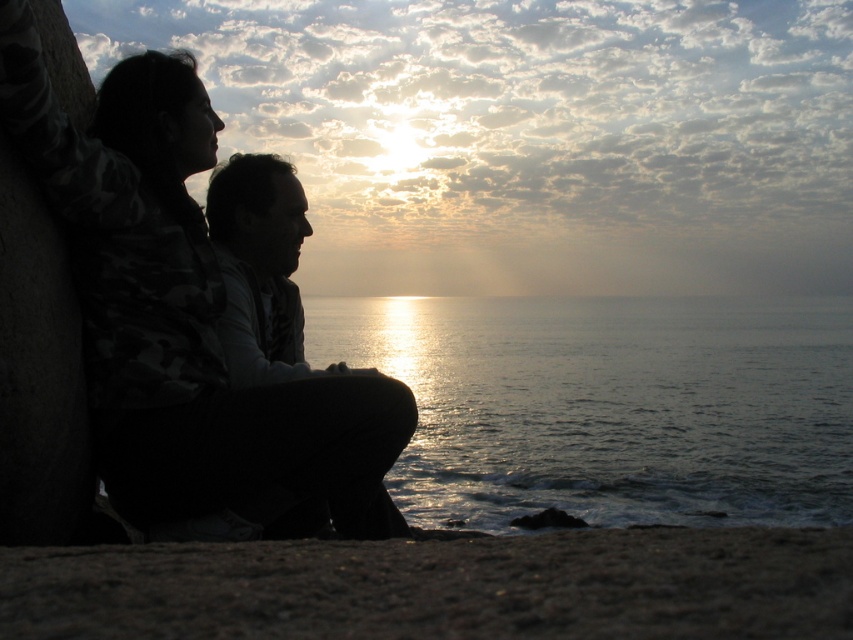
Between glistening silver water at center and dark sand at lower center, which one has less height?

Standing shorter between the two is dark sand at lower center.

Does glistening silver water at center appear under dark sand at lower center?

Actually, glistening silver water at center is above dark sand at lower center.

Does point (372, 314) come behind point (708, 593)?

Yes.

At what (x,y) coordinates should I click in order to perform the action: click on glistening silver water at center. Please return your answer as a coordinate pair (x, y). This screenshot has height=640, width=853. Looking at the image, I should click on (610, 404).

Is point (103, 284) positioned behind point (317, 502)?

No, (103, 284) is closer to viewer.

Who is taller, silhouette clothing at left or silhouette man at center?

silhouette clothing at left is taller.

In order to click on silhouette clothing at left in this screenshot , I will do coord(183,317).

The height and width of the screenshot is (640, 853). I want to click on silhouette clothing at left, so click(x=183, y=317).

Can you confirm if glistening silver water at center is positioned below silhouette clothing at left?

No.

Which is behind, point (734, 403) or point (366, 417)?

Positioned behind is point (734, 403).

Locate an element on the screen. Image resolution: width=853 pixels, height=640 pixels. glistening silver water at center is located at coordinates (610, 404).